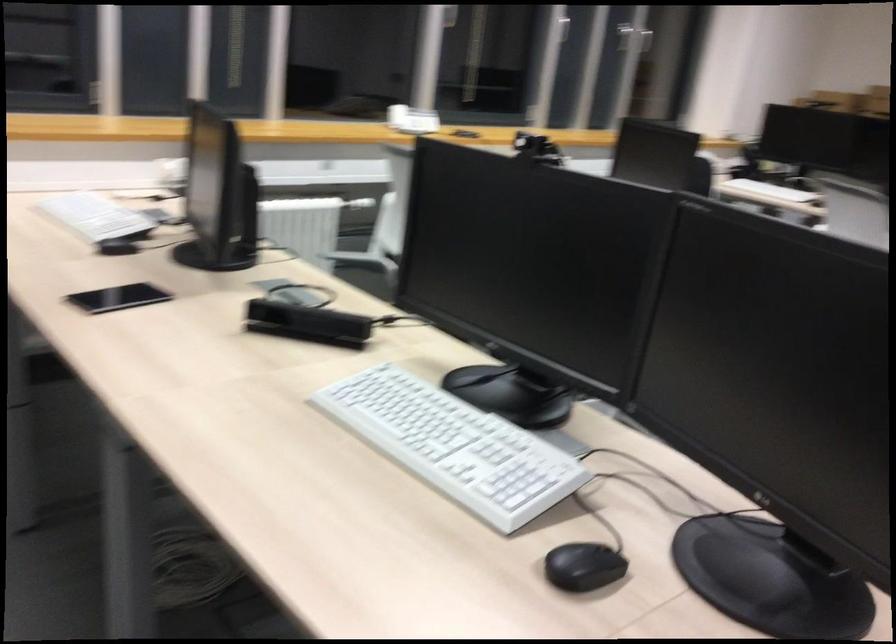
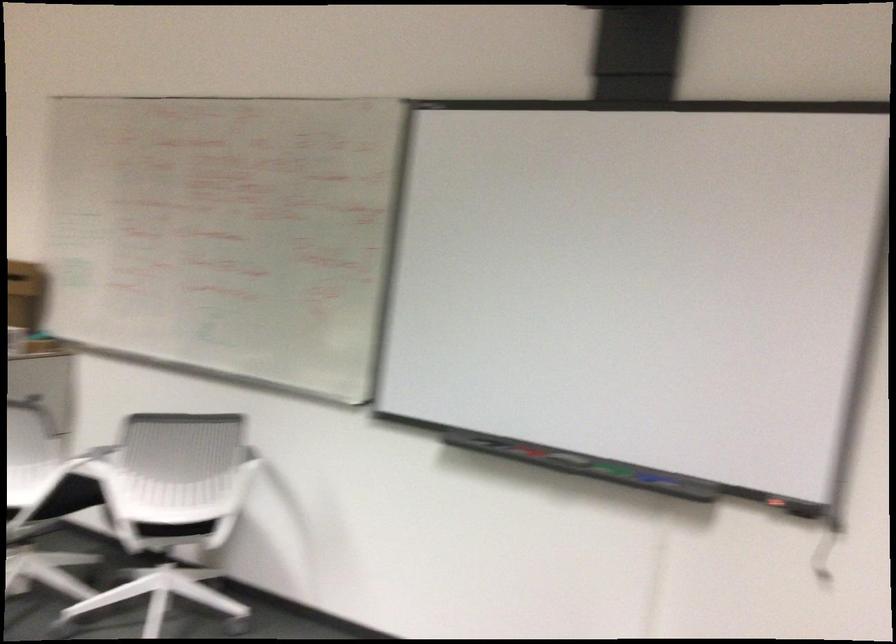
Question: What movement of the cameraman would produce the second image?

Choices:
 (A) Left
 (B) Right
 (C) Forward
 (D) Backward

Answer: (B)